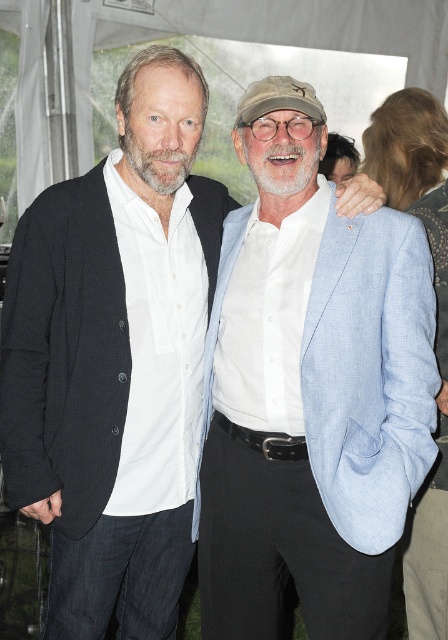
You are a photographer at the event and want to ensure both individuals are fully visible in your photo. The light blue linen blazer at center is at point (310, 388). Is the light blue linen blazer at center overlapping with the person on the left?

The light blue linen blazer at center is at point (310, 388). Since the person on the left is described as standing close together with the individual on the right, and the blazer is centered at that coordinate, it is likely overlapping with the person on the left.

Based on the photo, you are a tailor observing the light blue linen blazer at center and the white fabric canopy at upper center. Which item has a greater thickness?

The white fabric canopy at upper center is thicker than the light blue linen blazer at center.

You are taking a photo of the two people in the scene. The person on the left is at point [418,48] and the person on the right is at point [426,458]. Which person is closer to the camera?

Point [426,458] is closer to the camera than point [418,48], so the person on the right is closer to the camera.